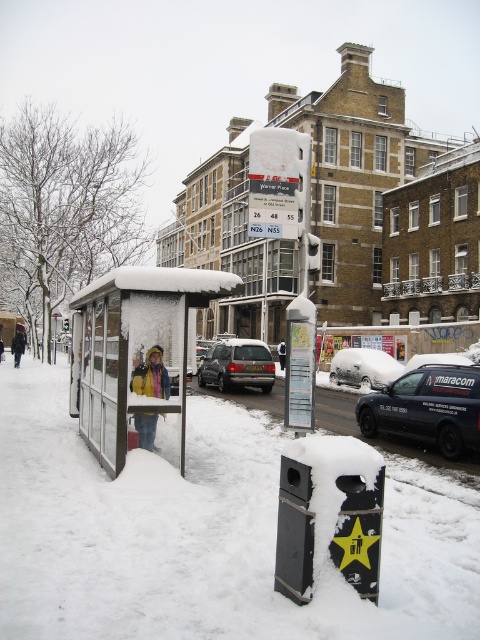
Question: Among these objects, which one is nearest to the camera?

Choices:
 (A) yellow jacket at center
 (B) white fluffy snow at lower center

Answer: (B)

Question: Which object is positioned closest to the black matte van at lower right?

Choices:
 (A) satin silver suv at center
 (B) yellow fabric jacket at left
 (C) black plastic trash can at lower center

Answer: (C)

Question: Where is snow-covered car at center located in relation to yellow jacket at center in the image?

Choices:
 (A) above
 (B) below

Answer: (B)

Question: Observing the image, what is the correct spatial positioning of snow-covered glass bus stop at lower left in reference to yellow jacket at center?

Choices:
 (A) right
 (B) left

Answer: (B)

Question: Which object is positioned farthest from the yellow jacket at center?

Choices:
 (A) black matte van at lower right
 (B) yellow fabric jacket at center
 (C) snow-covered car at center

Answer: (B)

Question: Can you confirm if black matte van at lower right is bigger than snow-covered car at center?

Choices:
 (A) yes
 (B) no

Answer: (A)